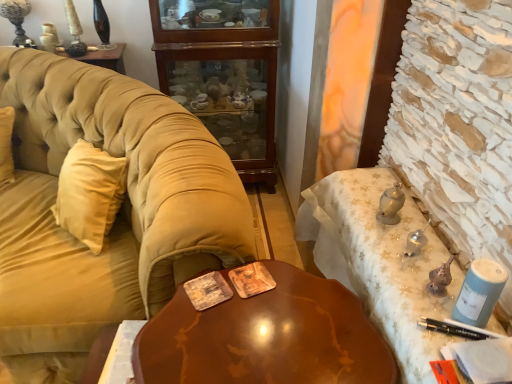
What is the approximate height of velvet beige couch at left?

35.63 inches.

This screenshot has width=512, height=384. What do you see at coordinates (116, 219) in the screenshot?
I see `velvet beige couch at left` at bounding box center [116, 219].

The image size is (512, 384). Identify the location of glossy wood table at center. (266, 337).

What do you see at coordinates (266, 337) in the screenshot?
I see `glossy wood table at center` at bounding box center [266, 337].

At what (x,y) coordinates should I click in order to perform the action: click on velvet beige couch at left. Please return your answer as a coordinate pair (x, y). Looking at the image, I should click on (116, 219).

Between glossy wood table at center and metallic silver desk at right, which one appears on the left side from the viewer's perspective?

Positioned to the left is glossy wood table at center.

From the image's perspective, would you say glossy wood table at center is positioned over metallic silver desk at right?

Incorrect, from the image's perspective, glossy wood table at center is lower than metallic silver desk at right.

Are glossy wood table at center and metallic silver desk at right making contact?

There is a gap between glossy wood table at center and metallic silver desk at right.

Who is taller, glossy wood table at center or metallic silver desk at right?

With more height is metallic silver desk at right.

Is mahogany wood cabinet at center placed right next to metallic silver desk at right?

mahogany wood cabinet at center is not next to metallic silver desk at right, and they're not touching.

Based on their sizes in the image, would you say mahogany wood cabinet at center is bigger or smaller than metallic silver desk at right?

In the image, mahogany wood cabinet at center appears to be larger than metallic silver desk at right.

Can metallic silver desk at right be found inside mahogany wood cabinet at center?

No, metallic silver desk at right is not inside mahogany wood cabinet at center.

Considering the sizes of objects mahogany wood cabinet at center and metallic silver desk at right in the image provided, who is wider, mahogany wood cabinet at center or metallic silver desk at right?

mahogany wood cabinet at center.

Is mahogany wood cabinet at center inside or outside of glossy wood table at center?

mahogany wood cabinet at center is located beyond the bounds of glossy wood table at center.

Is mahogany wood cabinet at center bigger than glossy wood table at center?

Correct, mahogany wood cabinet at center is larger in size than glossy wood table at center.

Does mahogany wood cabinet at center appear on the right side of glossy wood table at center?

Incorrect, mahogany wood cabinet at center is not on the right side of glossy wood table at center.

Who is shorter, mahogany wood cabinet at center or glossy wood table at center?

With less height is glossy wood table at center.

Is metallic silver desk at right beside glossy wood table at center?

There is a gap between metallic silver desk at right and glossy wood table at center.

Which is more to the left, metallic silver desk at right or glossy wood table at center?

Positioned to the left is glossy wood table at center.

Between metallic silver desk at right and glossy wood table at center, which one has larger width?

With larger width is glossy wood table at center.

Which object is closer to the camera, glossy wood table at center or mahogany wood cabinet at center?

Positioned in front is glossy wood table at center.

Is glossy wood table at center far from mahogany wood cabinet at center?

glossy wood table at center is positioned a significant distance from mahogany wood cabinet at center.

Could you tell me if glossy wood table at center is turned towards mahogany wood cabinet at center?

No, glossy wood table at center does not turn towards mahogany wood cabinet at center.

Looking at this image, considering the sizes of objects glossy wood table at center and mahogany wood cabinet at center in the image provided, who is wider, glossy wood table at center or mahogany wood cabinet at center?

glossy wood table at center is wider.

Based on their sizes in the image, would you say glossy wood table at center is bigger or smaller than velvet beige couch at left?

glossy wood table at center is smaller than velvet beige couch at left.

Which is correct: glossy wood table at center is inside velvet beige couch at left, or outside of it?

glossy wood table at center is not enclosed by velvet beige couch at left.

From the image's perspective, is glossy wood table at center positioned above or below velvet beige couch at left?

glossy wood table at center is situated lower than velvet beige couch at left in the image.

Is metallic silver desk at right at the back of velvet beige couch at left?

velvet beige couch at left does not have its back to metallic silver desk at right.

Is point (68, 143) positioned in front of point (338, 260)?

No, it is behind (338, 260).

Choose the correct answer: Is velvet beige couch at left inside metallic silver desk at right or outside it?

velvet beige couch at left cannot be found inside metallic silver desk at right.

Where is `desk located underneath the glossy wood table at center (from a real-world perspective)`? The height and width of the screenshot is (384, 512). desk located underneath the glossy wood table at center (from a real-world perspective) is located at coordinates (380, 262).

Locate an element on the screen. The height and width of the screenshot is (384, 512). desk located on the right of mahogany wood cabinet at center is located at coordinates (380, 262).

From the image, which object appears to be farther from glossy wood table at center, velvet beige couch at left or metallic silver desk at right?

The object further to glossy wood table at center is velvet beige couch at left.

When comparing their distances from metallic silver desk at right, does velvet beige couch at left or glossy wood table at center seem closer?

The object closer to metallic silver desk at right is glossy wood table at center.

From the picture: Considering their positions, is metallic silver desk at right positioned closer to velvet beige couch at left than mahogany wood cabinet at center?

metallic silver desk at right lies closer to velvet beige couch at left than the other object.

Which object lies nearer to the anchor point metallic silver desk at right, mahogany wood cabinet at center or velvet beige couch at left?

Among the two, velvet beige couch at left is located nearer to metallic silver desk at right.

When comparing their distances from glossy wood table at center, does metallic silver desk at right or velvet beige couch at left seem further?

Among the two, velvet beige couch at left is located further to glossy wood table at center.

Considering their positions, is glossy wood table at center positioned closer to velvet beige couch at left than metallic silver desk at right?

The object closer to velvet beige couch at left is glossy wood table at center.

When comparing their distances from metallic silver desk at right, does mahogany wood cabinet at center or glossy wood table at center seem further?

Among the two, mahogany wood cabinet at center is located further to metallic silver desk at right.

Based on their spatial positions, is mahogany wood cabinet at center or metallic silver desk at right further from velvet beige couch at left?

mahogany wood cabinet at center.

You are a GUI agent. You are given a task and a screenshot of the screen. Output one action in this format:
    pyautogui.click(x=<x>, y=<y>)
    Task: Click on the studio couch between metallic silver desk at right and mahogany wood cabinet at center in the front-back direction
    The height and width of the screenshot is (384, 512).
    Given the screenshot: What is the action you would take?
    coord(116,219)

Where is `table located between velvet beige couch at left and metallic silver desk at right in the left-right direction`? This screenshot has height=384, width=512. table located between velvet beige couch at left and metallic silver desk at right in the left-right direction is located at coordinates (266, 337).

Identify the location of table positioned between metallic silver desk at right and mahogany wood cabinet at center from near to far. This screenshot has width=512, height=384. (266, 337).

You are a GUI agent. You are given a task and a screenshot of the screen. Output one action in this format:
    pyautogui.click(x=<x>, y=<y>)
    Task: Click on the studio couch located between glossy wood table at center and mahogany wood cabinet at center in the depth direction
    
    Given the screenshot: What is the action you would take?
    pyautogui.click(x=116, y=219)